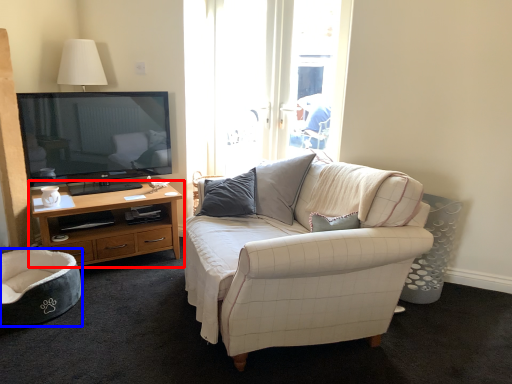
Question: Which point is further to the camera, cabinetry (highlighted by a red box) or chair (highlighted by a blue box)?

Choices:
 (A) cabinetry
 (B) chair

Answer: (A)